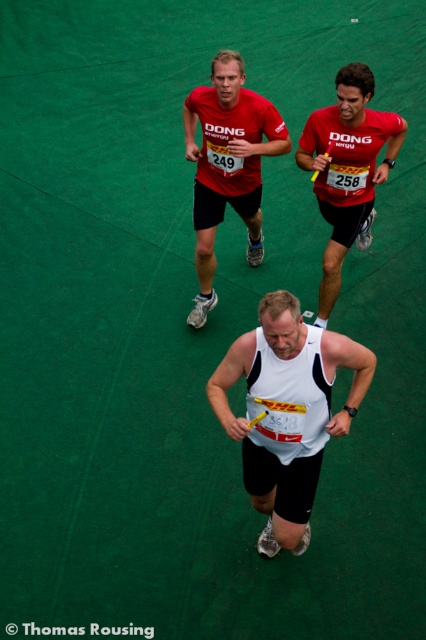
Question: Among these objects, which one is farthest from the camera?

Choices:
 (A) matte red shirt at upper center
 (B) red matte jersey at upper right

Answer: (A)

Question: Does white matte vest at center have a greater width compared to red matte jersey at upper right?

Choices:
 (A) no
 (B) yes

Answer: (B)

Question: Which object is farther from the camera taking this photo?

Choices:
 (A) white matte vest at center
 (B) matte red shirt at upper center
 (C) red matte jersey at upper right

Answer: (B)

Question: Is white matte vest at center positioned in front of red matte jersey at upper right?

Choices:
 (A) no
 (B) yes

Answer: (B)

Question: Can you confirm if white matte vest at center is positioned below matte red shirt at upper center?

Choices:
 (A) yes
 (B) no

Answer: (A)

Question: Based on their relative distances, which object is nearer to the white matte vest at center?

Choices:
 (A) red matte jersey at upper right
 (B) matte red shirt at upper center

Answer: (A)